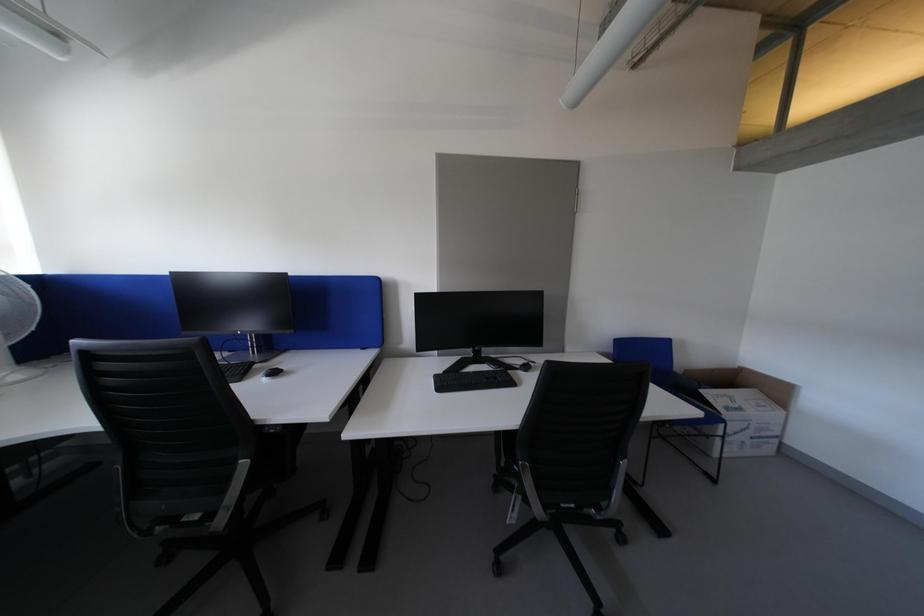
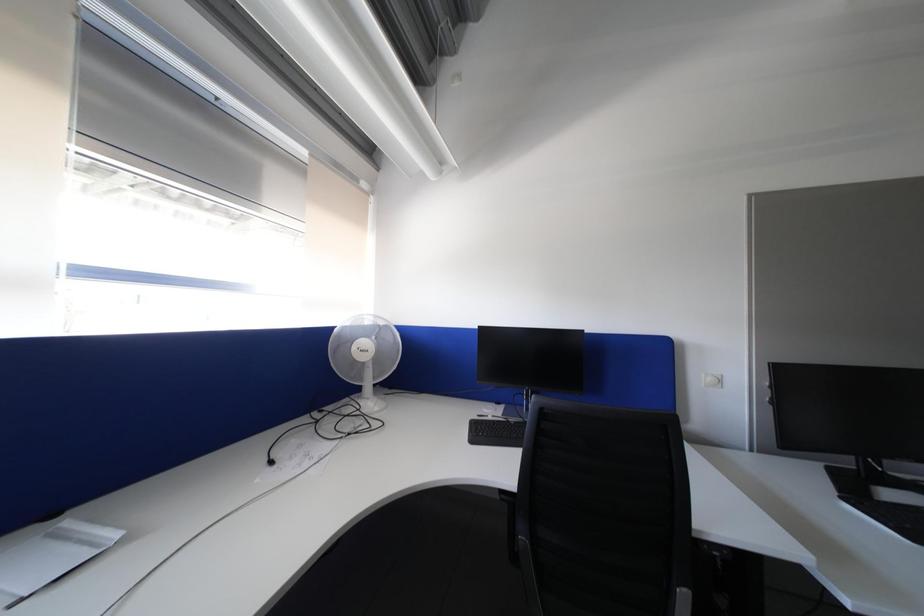
Question: The images are taken continuously from a first-person perspective. In which direction are you moving?

Choices:
 (A) Left
 (B) Right
 (C) Forward
 (D) Backward

Answer: (A)